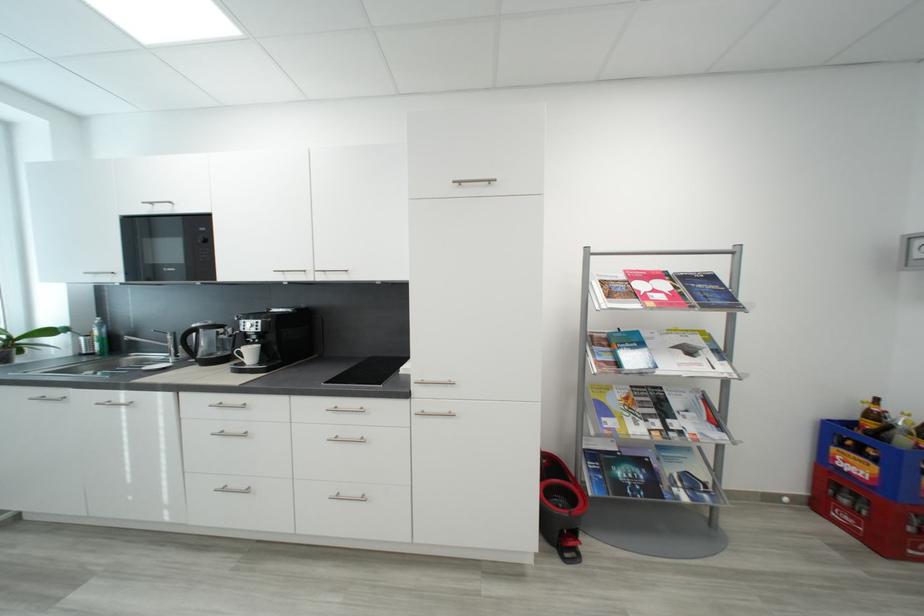
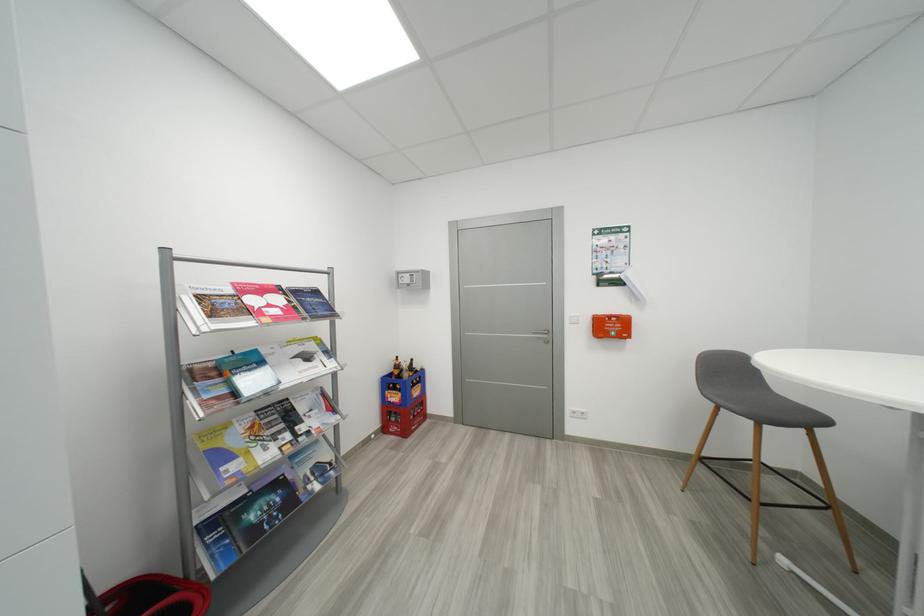
Locate, in the second image, the point that corresponds to point 823,507 in the first image.

(392, 431)